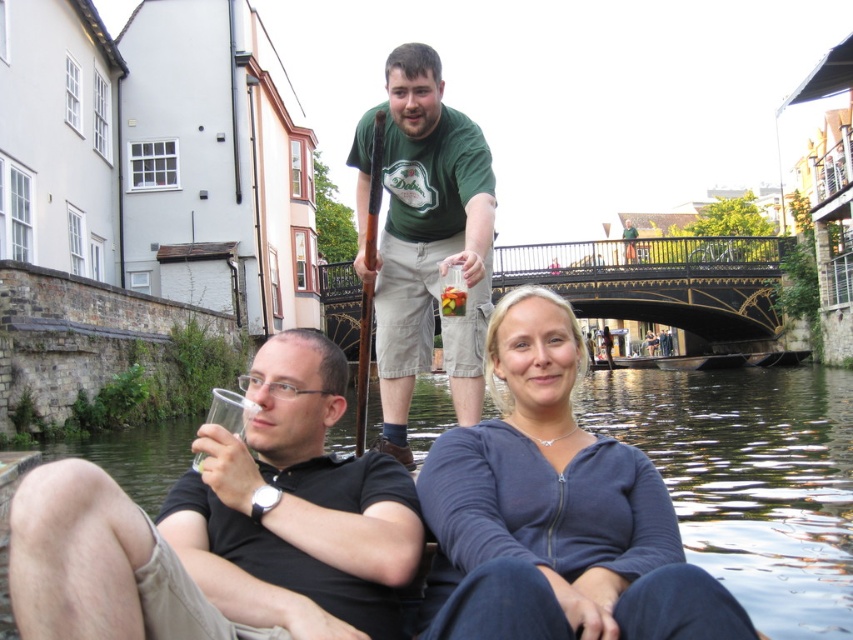
You are a tourist standing on the bridge looking down at the canal. You want to take a photo of the transparent plastic water at center. Where should you aim your camera to capture it?

You should aim your camera at point 0.750 on the horizontal axis and 0.879 on the vertical axis to capture the transparent plastic water at center.

You are standing on the canal bank and want to take a photo of the black matte shirt at lower left. If your camera has a maximum focus range of 80 feet, will you be able to capture the shirt clearly?

The black matte shirt at lower left is 84.98 feet from viewer. Since the camera can only focus up to 80 feet, it won